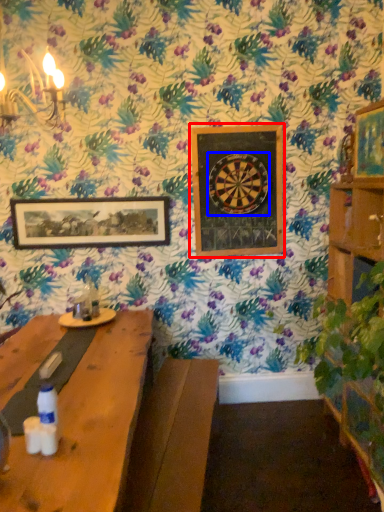
Question: Which object is further to the camera taking this photo, picture frame (highlighted by a red box) or design (highlighted by a blue box)?

Choices:
 (A) picture frame
 (B) design

Answer: (A)